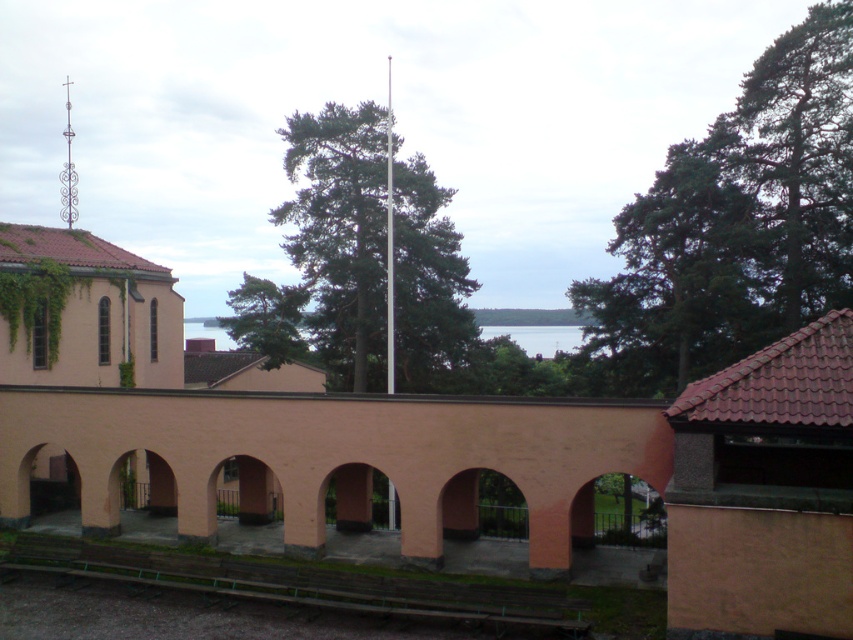
You are standing at the entrance of the building and want to know if the green leafy tree at upper right can block the view of the silver metallic flag pole at center. Can you determine this based on their widths?

The green leafy tree at upper right might be wider than silver metallic flag pole at center, so it could potentially block the view depending on their exact positions and angles.

In the scene shown: You are standing at the entrance of the building with the cross on its roof. You want to walk straight ahead towards the water in the background. Will the green leafy tree at center block your path?

The green leafy tree at center is located at point (267, 317), which is directly in front of your path towards the water. Therefore, the tree will block your path.

You are a park visitor who wants to place a picnic blanket between the green leafy tree at center and the silver metallic flag pole at center. The blanket is 10 feet long. Will the blanket fit between them without overlapping either object?

The distance between the green leafy tree at center and the silver metallic flag pole at center is 55.60 feet. Since the picnic blanket is only 10 feet long, there is ample space to place it between them without overlapping either object.